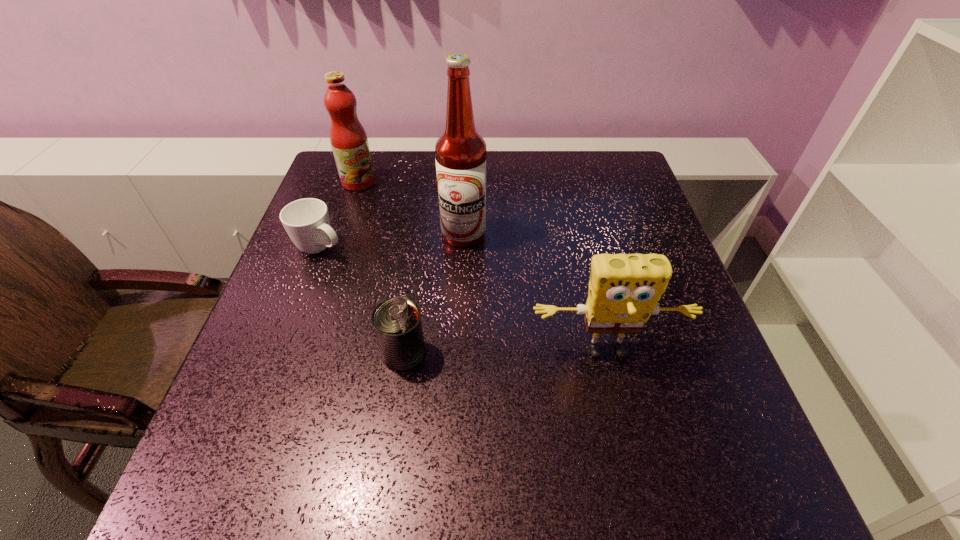
Image resolution: width=960 pixels, height=540 pixels. What are the coordinates of `vacant point located between the cup and the alcohol` in the screenshot? It's located at (393, 241).

Locate an element on the screen. This screenshot has height=540, width=960. object that is the third closest one to the shortest object is located at coordinates (397, 324).

You are a GUI agent. You are given a task and a screenshot of the screen. Output one action in this format:
    pyautogui.click(x=<x>, y=<y>)
    Task: Click on the object that is the closest one to the farthest object
    Image resolution: width=960 pixels, height=540 pixels.
    Given the screenshot: What is the action you would take?
    pyautogui.click(x=307, y=222)

This screenshot has width=960, height=540. Find the location of `blank area in the image that satisfies the following two spatial constraints: 1. on the back side of the tallest object; 2. on the right side of the shortest object`. blank area in the image that satisfies the following two spatial constraints: 1. on the back side of the tallest object; 2. on the right side of the shortest object is located at coordinates (325, 234).

This screenshot has width=960, height=540. Identify the location of vacant space that satisfies the following two spatial constraints: 1. on the back side of the farthest object; 2. on the right side of the cup. (346, 182).